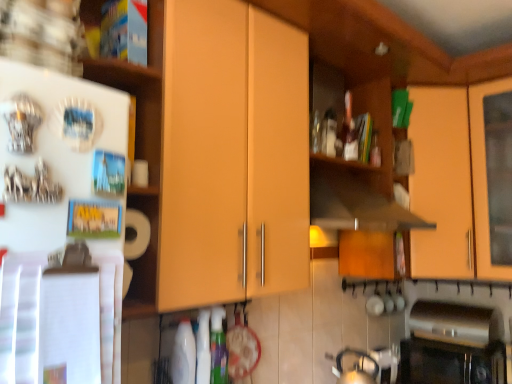
I want to click on white paper towel at left, the 2th shelf positioned from the top, so point(141,149).

Is black glass oven at lower right looking in the opposite direction of wooden cabinet door at upper left, the 2th shelf positioned from the bottom?

That's not correct — black glass oven at lower right is not looking away from wooden cabinet door at upper left, the 2th shelf positioned from the bottom.

Is black glass oven at lower right at the left side of wooden cabinet door at upper left, which ranks as the first shelf in top-to-bottom order?

No, black glass oven at lower right is not to the left of wooden cabinet door at upper left, which ranks as the first shelf in top-to-bottom order.

Can you tell me how much black glass oven at lower right and wooden cabinet door at upper left, the 2th shelf positioned from the bottom, differ in facing direction?

There is a 88.6-degree angle between the facing directions of black glass oven at lower right and wooden cabinet door at upper left, the 2th shelf positioned from the bottom.

Is black glass oven at lower right bigger or smaller than wooden cabinet door at upper left, which ranks as the first shelf in top-to-bottom order?

Clearly, black glass oven at lower right is larger in size than wooden cabinet door at upper left, which ranks as the first shelf in top-to-bottom order.

Based on the photo, is matte orange cabinet at upper right, the 1th cabinetry from the back, directly adjacent to black glass oven at lower right?

No.

Considering the relative positions of matte orange cabinet at upper right, arranged as the first cabinetry when viewed from the right, and black glass oven at lower right in the image provided, is matte orange cabinet at upper right, arranged as the first cabinetry when viewed from the right, in front of black glass oven at lower right?

Yes, matte orange cabinet at upper right, arranged as the first cabinetry when viewed from the right, is closer to the viewer.

Locate an element on the screen. The height and width of the screenshot is (384, 512). oven on the left of matte orange cabinet at upper right, arranged as the first cabinetry when viewed from the right is located at coordinates (451, 363).

Does point (347, 370) lie behind point (197, 151)?

Yes, it is.

Considering the relative positions of silver metallic tea pot at lower right and matte wood cabinet at center, acting as the first cabinetry starting from the left, in the image provided, is silver metallic tea pot at lower right to the right of matte wood cabinet at center, acting as the first cabinetry starting from the left, from the viewer's perspective?

Correct, you'll find silver metallic tea pot at lower right to the right of matte wood cabinet at center, acting as the first cabinetry starting from the left.

From the picture: Can you tell me how much silver metallic tea pot at lower right and matte wood cabinet at center, acting as the first cabinetry starting from the left, differ in facing direction?

6.96 degrees separate the facing orientations of silver metallic tea pot at lower right and matte wood cabinet at center, acting as the first cabinetry starting from the left.

Is silver metallic tea pot at lower right shorter than matte wood cabinet at center, marked as the 2th cabinetry in a right-to-left arrangement?

Yes, silver metallic tea pot at lower right is shorter than matte wood cabinet at center, marked as the 2th cabinetry in a right-to-left arrangement.

Which object is wider, silver metallic tea pot at lower right or black glass oven at lower right?

With larger width is black glass oven at lower right.

Considering the relative sizes of silver metallic tea pot at lower right and black glass oven at lower right in the image provided, is silver metallic tea pot at lower right smaller than black glass oven at lower right?

Correct, silver metallic tea pot at lower right occupies less space than black glass oven at lower right.

This screenshot has height=384, width=512. I want to click on oven below the silver metallic tea pot at lower right (from a real-world perspective), so click(x=451, y=363).

Between silver metallic tea pot at lower right and black glass oven at lower right, which one is positioned in front?

silver metallic tea pot at lower right is more forward.

Is white paper towel at left, the 2th shelf positioned from the top, in front of or behind matte wood cabinet at center, which is the first cabinetry from front to back, in the image?

white paper towel at left, the 2th shelf positioned from the top, is positioned closer to the viewer than matte wood cabinet at center, which is the first cabinetry from front to back.

Are white paper towel at left, which ranks as the 1th shelf in bottom-to-top order, and matte wood cabinet at center, marked as the 2th cabinetry in a right-to-left arrangement, located far from each other?

Actually, white paper towel at left, which ranks as the 1th shelf in bottom-to-top order, and matte wood cabinet at center, marked as the 2th cabinetry in a right-to-left arrangement, are a little close together.

From the image's perspective, does white paper towel at left, which ranks as the 1th shelf in bottom-to-top order, appear lower than matte wood cabinet at center, acting as the 2th cabinetry starting from the back?

Incorrect, from the image's perspective, white paper towel at left, which ranks as the 1th shelf in bottom-to-top order, is higher than matte wood cabinet at center, acting as the 2th cabinetry starting from the back.

Is white paper towel at left, which ranks as the 1th shelf in bottom-to-top order, wider or thinner than matte wood cabinet at center, acting as the 2th cabinetry starting from the back?

In the image, white paper towel at left, which ranks as the 1th shelf in bottom-to-top order, appears to be more narrow than matte wood cabinet at center, acting as the 2th cabinetry starting from the back.

Is matte wood cabinet at center, acting as the first cabinetry starting from the left, at the back of wooden cabinet door at upper left, which ranks as the first shelf in top-to-bottom order?

No, wooden cabinet door at upper left, which ranks as the first shelf in top-to-bottom order, is not facing away from matte wood cabinet at center, acting as the first cabinetry starting from the left.

Is wooden cabinet door at upper left, which ranks as the first shelf in top-to-bottom order, bigger or smaller than matte wood cabinet at center, marked as the 2th cabinetry in a right-to-left arrangement?

Clearly, wooden cabinet door at upper left, which ranks as the first shelf in top-to-bottom order, is smaller in size than matte wood cabinet at center, marked as the 2th cabinetry in a right-to-left arrangement.

From the image's perspective, between wooden cabinet door at upper left, which ranks as the first shelf in top-to-bottom order, and matte wood cabinet at center, acting as the 2th cabinetry starting from the back, which one is located above?

wooden cabinet door at upper left, which ranks as the first shelf in top-to-bottom order.

Does wooden cabinet door at upper left, the 2th shelf positioned from the bottom, come in front of matte wood cabinet at center, acting as the first cabinetry starting from the left?

No, wooden cabinet door at upper left, the 2th shelf positioned from the bottom, is further to the viewer.

Consider the image. From the image's perspective, would you say matte orange cabinet at upper right, the second cabinetry from the front, is shown under wooden cabinet door at upper left, which ranks as the first shelf in top-to-bottom order?

Yes, from the image's perspective, matte orange cabinet at upper right, the second cabinetry from the front, is below wooden cabinet door at upper left, which ranks as the first shelf in top-to-bottom order.

From a real-world perspective, is matte orange cabinet at upper right, the second cabinetry from the front, positioned under wooden cabinet door at upper left, which ranks as the first shelf in top-to-bottom order, based on gravity?

Correct, in the physical world, matte orange cabinet at upper right, the second cabinetry from the front, is lower than wooden cabinet door at upper left, which ranks as the first shelf in top-to-bottom order.

Relative to wooden cabinet door at upper left, which ranks as the first shelf in top-to-bottom order, is matte orange cabinet at upper right, the 1th cabinetry from the back, in front or behind?

Clearly, matte orange cabinet at upper right, the 1th cabinetry from the back, is behind wooden cabinet door at upper left, which ranks as the first shelf in top-to-bottom order.

Starting from the black glass oven at lower right, which shelf is the 1st one in front? Please provide its 2D coordinates.

[(90, 11)]

This screenshot has height=384, width=512. In order to click on cabinetry on the right of black glass oven at lower right in this screenshot , I will do `click(452, 183)`.

Looking at the image, which one is located closer to matte wood cabinet at center, marked as the 2th cabinetry in a right-to-left arrangement, wooden cabinet door at upper left, which ranks as the first shelf in top-to-bottom order, or matte orange cabinet at upper right, the second cabinetry from the front?

wooden cabinet door at upper left, which ranks as the first shelf in top-to-bottom order, is positioned closer to the anchor matte wood cabinet at center, marked as the 2th cabinetry in a right-to-left arrangement.

Estimate the real-world distances between objects in this image. Which object is further from matte wood cabinet at center, acting as the 2th cabinetry starting from the back, white paper towel at left, which ranks as the 1th shelf in bottom-to-top order, or silver metallic tea pot at lower right?

silver metallic tea pot at lower right is positioned further to the anchor matte wood cabinet at center, acting as the 2th cabinetry starting from the back.

Based on their spatial positions, is matte orange cabinet at upper right, placed as the second cabinetry when sorted from left to right, or wooden cabinet door at upper left, which ranks as the first shelf in top-to-bottom order, closer to silver metallic tea pot at lower right?

matte orange cabinet at upper right, placed as the second cabinetry when sorted from left to right, lies closer to silver metallic tea pot at lower right than the other object.

Looking at the image, which one is located further to matte orange cabinet at upper right, arranged as the first cabinetry when viewed from the right, silver metallic tea pot at lower right or white paper towel at left, which ranks as the 1th shelf in bottom-to-top order?

The object further to matte orange cabinet at upper right, arranged as the first cabinetry when viewed from the right, is white paper towel at left, which ranks as the 1th shelf in bottom-to-top order.

Looking at the image, which one is located closer to wooden cabinet door at upper left, which ranks as the first shelf in top-to-bottom order, matte wood cabinet at center, acting as the first cabinetry starting from the left, or silver metallic tea pot at lower right?

matte wood cabinet at center, acting as the first cabinetry starting from the left, lies closer to wooden cabinet door at upper left, which ranks as the first shelf in top-to-bottom order, than the other object.

Looking at the image, which one is located further to wooden cabinet door at upper left, the 2th shelf positioned from the bottom, white paper towel at left, the 2th shelf positioned from the top, or matte orange cabinet at upper right, placed as the second cabinetry when sorted from left to right?

Based on the image, matte orange cabinet at upper right, placed as the second cabinetry when sorted from left to right, appears to be further to wooden cabinet door at upper left, the 2th shelf positioned from the bottom.

Estimate the real-world distances between objects in this image. Which object is closer to silver metallic tea pot at lower right, white paper towel at left, which ranks as the 1th shelf in bottom-to-top order, or matte orange cabinet at upper right, placed as the second cabinetry when sorted from left to right?

matte orange cabinet at upper right, placed as the second cabinetry when sorted from left to right, is positioned closer to the anchor silver metallic tea pot at lower right.

Estimate the real-world distances between objects in this image. Which object is further from black glass oven at lower right, wooden cabinet door at upper left, which ranks as the first shelf in top-to-bottom order, or matte wood cabinet at center, acting as the first cabinetry starting from the left?

wooden cabinet door at upper left, which ranks as the first shelf in top-to-bottom order, is further to black glass oven at lower right.

Identify the location of shelf located between white paper towel at left, which ranks as the 1th shelf in bottom-to-top order, and matte orange cabinet at upper right, the second cabinetry from the front, in the left-right direction. This screenshot has height=384, width=512. (90, 11).

At what (x,y) coordinates should I click in order to perform the action: click on tea pot between matte orange cabinet at upper right, the 1th cabinetry from the back, and black glass oven at lower right from top to bottom. Please return your answer as a coordinate pair (x, y). Looking at the image, I should click on (355, 368).

This screenshot has width=512, height=384. In order to click on tea pot between wooden cabinet door at upper left, which ranks as the first shelf in top-to-bottom order, and matte orange cabinet at upper right, the second cabinetry from the front, in the horizontal direction in this screenshot , I will do `click(355, 368)`.

Find the location of `cabinetry situated between wooden cabinet door at upper left, which ranks as the first shelf in top-to-bottom order, and black glass oven at lower right from left to right`. cabinetry situated between wooden cabinet door at upper left, which ranks as the first shelf in top-to-bottom order, and black glass oven at lower right from left to right is located at coordinates pos(232,155).